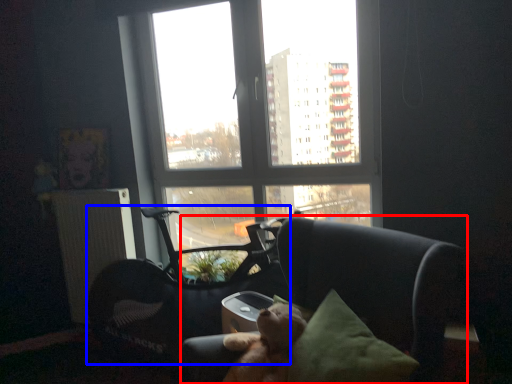
Question: Which point is closer to the camera, chair (highlighted by a red box) or swivel chair (highlighted by a blue box)?

Choices:
 (A) chair
 (B) swivel chair

Answer: (A)